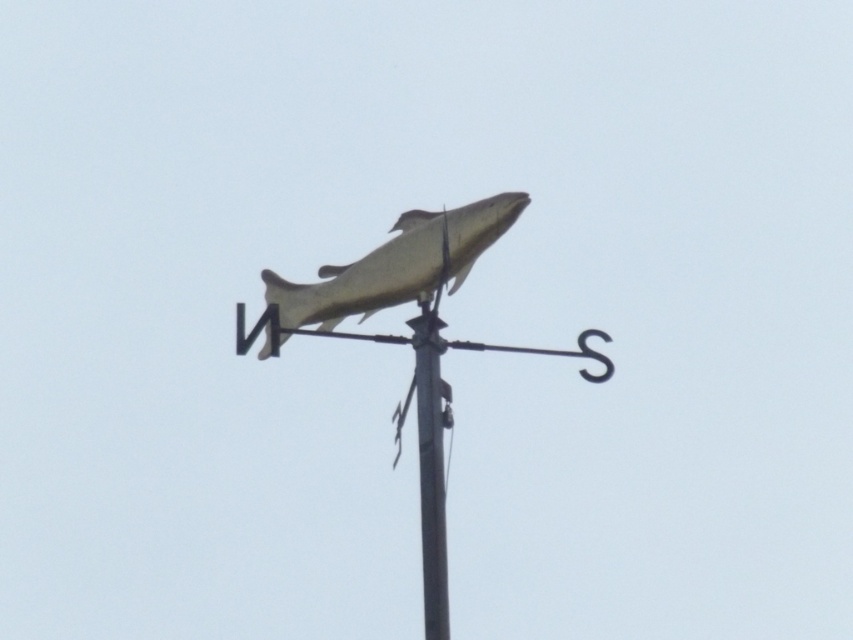
Question: Does metallic gold fish at upper center have a smaller size compared to shiny gold fish at center?

Choices:
 (A) yes
 (B) no

Answer: (B)

Question: Which of the following is the closest to the observer?

Choices:
 (A) (445, 324)
 (B) (410, 243)
 (C) (329, 332)

Answer: (A)

Question: Which point appears closest to the camera in this image?

Choices:
 (A) (422, 532)
 (B) (434, 336)

Answer: (A)

Question: Among these points, which one is nearest to the camera?

Choices:
 (A) (303, 289)
 (B) (425, 544)

Answer: (B)

Question: In this image, where is metallic gold fish at upper center located relative to metallic pole at center?

Choices:
 (A) left
 (B) right

Answer: (A)

Question: Is shiny gold fish at center closer to camera compared to metallic pole at center?

Choices:
 (A) no
 (B) yes

Answer: (A)